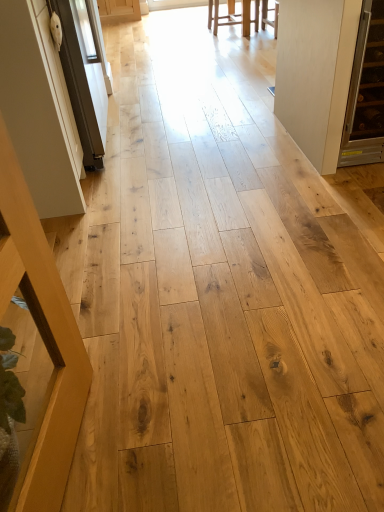
What are the coordinates of `vacant space behind natural wood table at left, which appears as the first furniture when ordered from the bottom` in the screenshot? It's located at (127, 348).